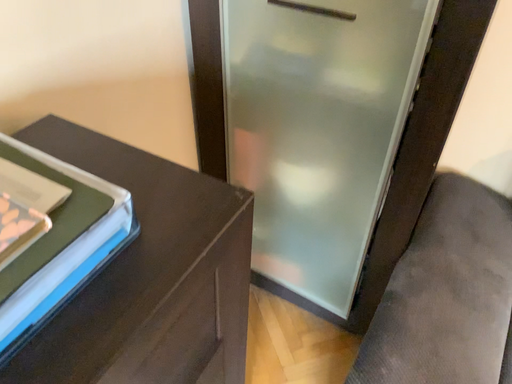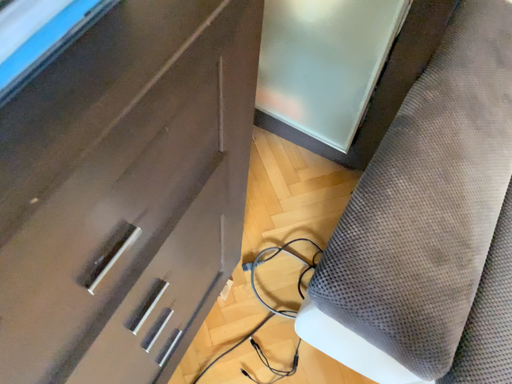
Question: Which way did the camera rotate in the video?

Choices:
 (A) rotated upward
 (B) rotated downward

Answer: (B)